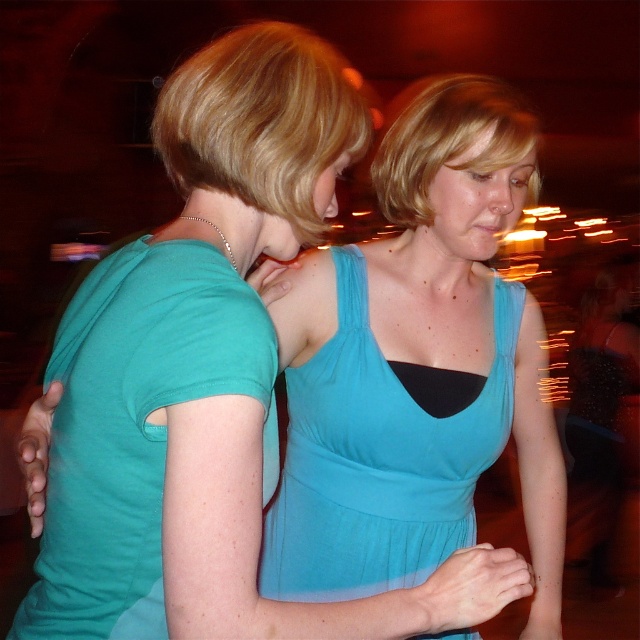
You are a photographer adjusting the focus of your camera. You want to ensure both the teal jersey dress at center and the blonde hair at upper center are in focus. The camera has a depth of field that can cover 20 inches. Will both objects be in focus?

The teal jersey dress at center and the blonde hair at upper center are 19.65 inches apart from each other. Since the depth of field can cover 20 inches, both objects will be in focus.

You are an observer looking at the scene. There are two people in the image. One is wearing a matte teal shirt at left and the other has blonde hair at upper center. Which person is positioned to the left of the other?

The matte teal shirt at left is positioned on the left side of blonde hair at upper center, so the person wearing the matte teal shirt at left is to the left of the person with blonde hair at upper center.

You are a photographer trying to focus on the point at coordinates point (134, 428). Based on the scene, which object from the list contains this point?

The point (134, 428) is on the matte teal shirt at left.